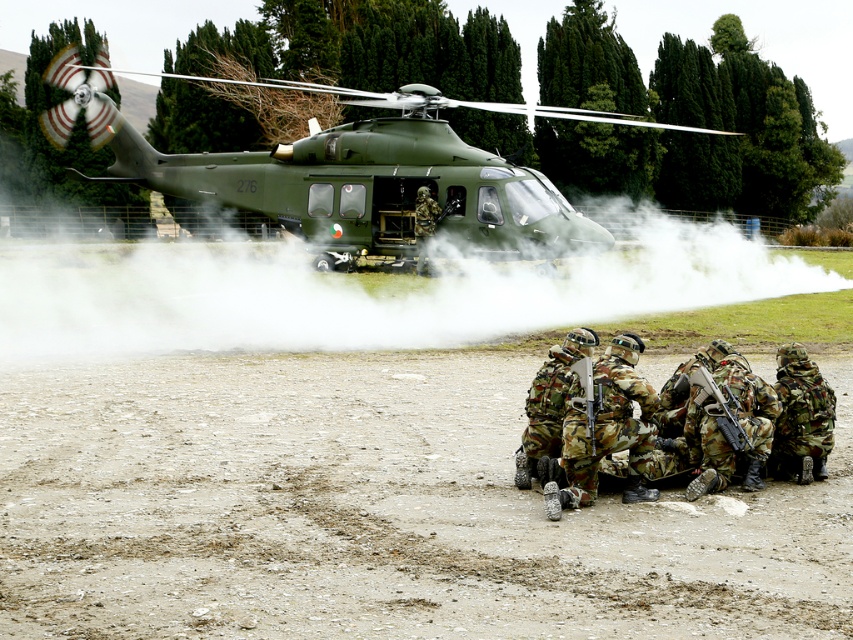
Question: Is camo fabric soldiers at lower center smaller than camouflage fabric rifle at center?

Choices:
 (A) no
 (B) yes

Answer: (A)

Question: Which is farther from the camo fabric soldiers at lower center?

Choices:
 (A) camouflage fabric helmet at lower right
 (B) camouflage fabric rifle at center

Answer: (A)

Question: Does camo fabric soldiers at lower center appear on the right side of camouflage fabric helmet at lower right?

Choices:
 (A) no
 (B) yes

Answer: (A)

Question: Based on their relative distances, which object is farther from the camouflage fabric rifle at center?

Choices:
 (A) green matte helicopter at upper center
 (B) camo fabric soldiers at lower center
 (C) matte black rifle at center

Answer: (A)

Question: Is dirt field at lower center positioned in front of camouflage fabric rifle at center?

Choices:
 (A) yes
 (B) no

Answer: (A)

Question: Considering the real-world distances, which object is closest to the camouflage fabric rifle at center?

Choices:
 (A) dirt field at lower center
 (B) camouflage fabric helmet at lower right
 (C) camo fabric soldiers at lower center

Answer: (C)